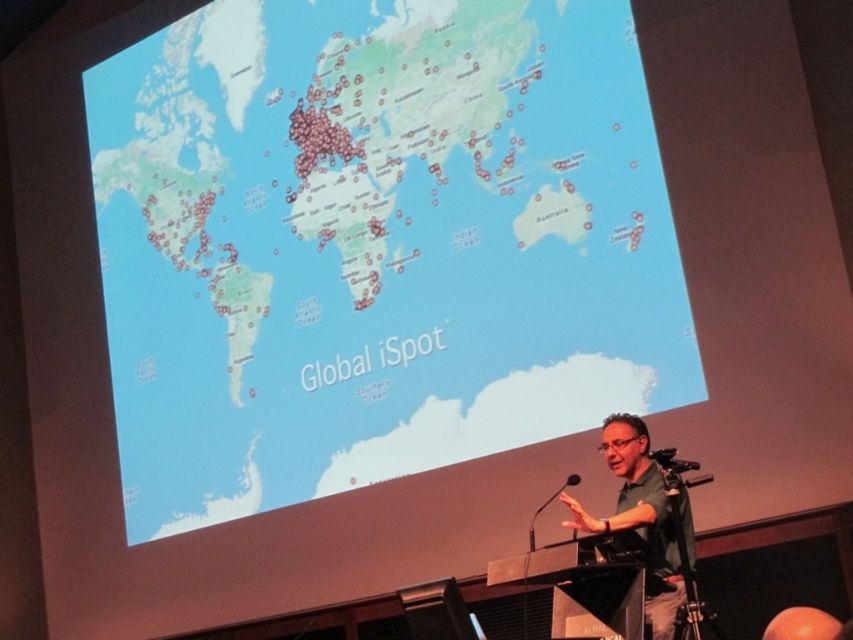
Question: Among these objects, which one is farthest from the camera?

Choices:
 (A) matte map at center
 (B) orange matte ball at lower right
 (C) black plastic speaker at lower center

Answer: (A)

Question: Is matte map at center bigger than black plastic speaker at lower center?

Choices:
 (A) yes
 (B) no

Answer: (A)

Question: Observing the image, what is the correct spatial positioning of green fabric shirt at lower right in reference to orange matte ball at lower right?

Choices:
 (A) above
 (B) below

Answer: (A)

Question: Observing the image, what is the correct spatial positioning of green fabric shirt at lower right in reference to black plastic speaker at lower center?

Choices:
 (A) below
 (B) above

Answer: (B)

Question: Among these objects, which one is nearest to the camera?

Choices:
 (A) black plastic speaker at lower center
 (B) green fabric shirt at lower right
 (C) black plastic microphone at lower center

Answer: (B)

Question: Considering the real-world distances, which object is farthest from the black plastic microphone at lower center?

Choices:
 (A) matte map at center
 (B) black plastic speaker at lower center

Answer: (A)